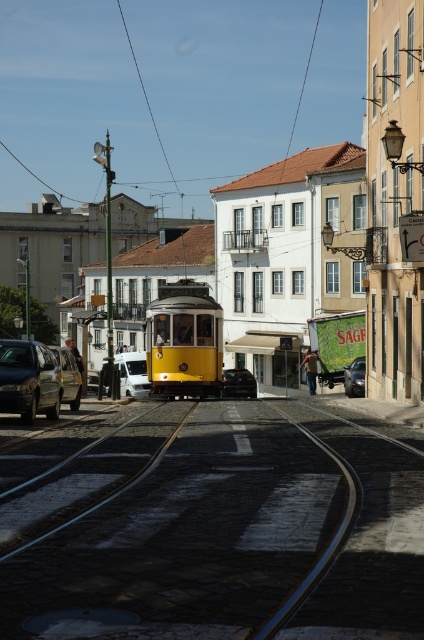
Question: Does matte black car at left have a lesser width compared to white matte van at center?

Choices:
 (A) yes
 (B) no

Answer: (A)

Question: Which of the following is the closest to the observer?

Choices:
 (A) (122, 387)
 (B) (78, 378)
 (C) (351, 364)
 (D) (52, 400)

Answer: (D)

Question: Which object is positioned farthest from the shiny black car at center?

Choices:
 (A) matte black car at left
 (B) black asphalt train track at center
 (C) shiny black sedan at center

Answer: (B)

Question: From the image, what is the correct spatial relationship of matte black car at left in relation to shiny black car at center?

Choices:
 (A) left
 (B) right

Answer: (A)

Question: Can you confirm if matte black car at left is positioned below metallic silver van at left?

Choices:
 (A) yes
 (B) no

Answer: (B)

Question: Estimate the real-world distances between objects in this image. Which object is farther from the shiny black sedan at center?

Choices:
 (A) metallic silver van at left
 (B) black asphalt train track at center
 (C) shiny black car at center
 (D) white matte van at center

Answer: (B)